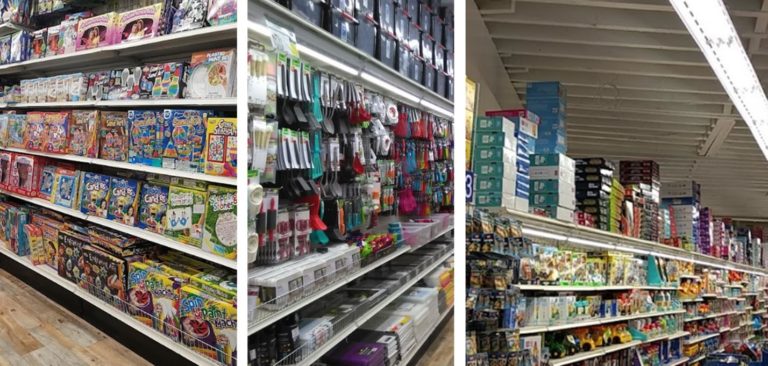
Find the location of a particular element. This screenshot has width=768, height=366. middle shelf is located at coordinates (373, 261).